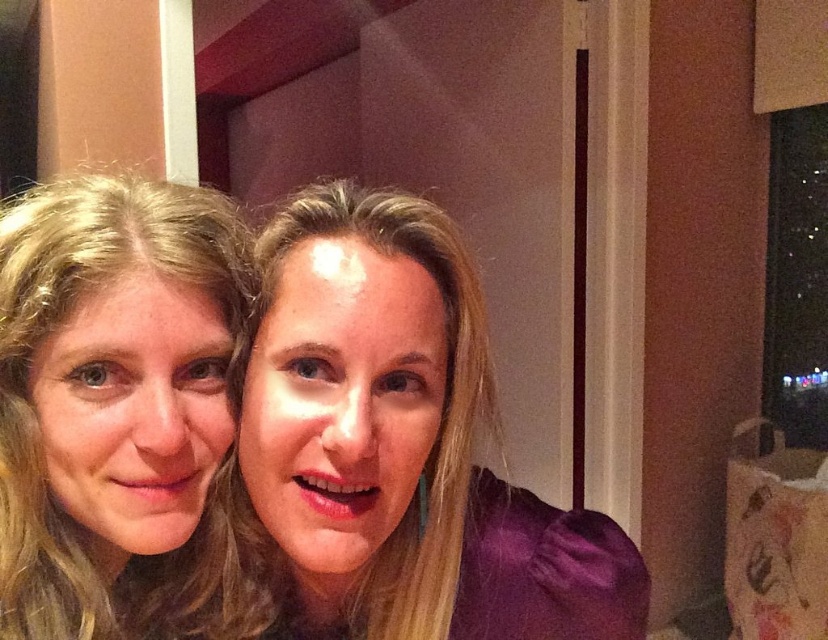
Question: Does purple satin blouse at center have a lesser width compared to blonde hair at left?

Choices:
 (A) no
 (B) yes

Answer: (A)

Question: Can you confirm if purple satin blouse at center is bigger than blonde hair at left?

Choices:
 (A) yes
 (B) no

Answer: (A)

Question: Is purple satin blouse at center to the right of blonde hair at left from the viewer's perspective?

Choices:
 (A) yes
 (B) no

Answer: (A)

Question: Which of the following is the farthest from the observer?

Choices:
 (A) (395, 426)
 (B) (220, 260)

Answer: (B)

Question: Which point is farther to the camera?

Choices:
 (A) blonde hair at left
 (B) purple satin blouse at center

Answer: (A)